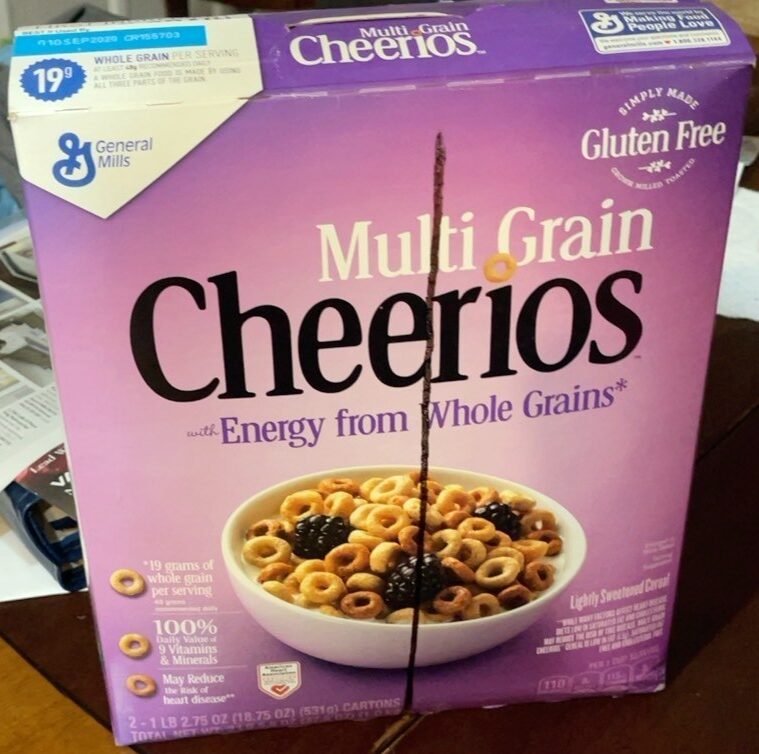
Locate an element on the screen. bowl is located at coordinates (x=391, y=645).